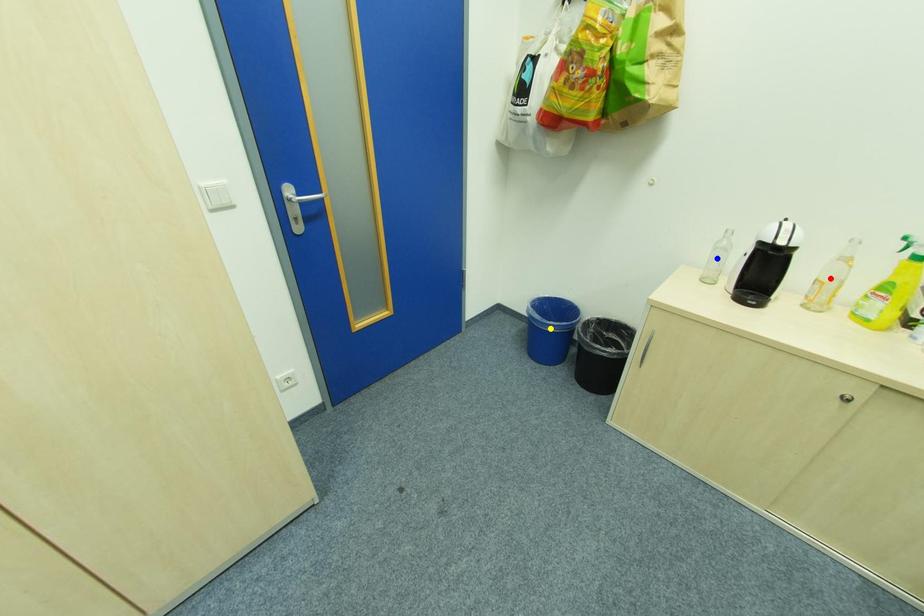
Order these from nearest to farthest:
- blue point
- yellow point
- red point

red point, blue point, yellow point